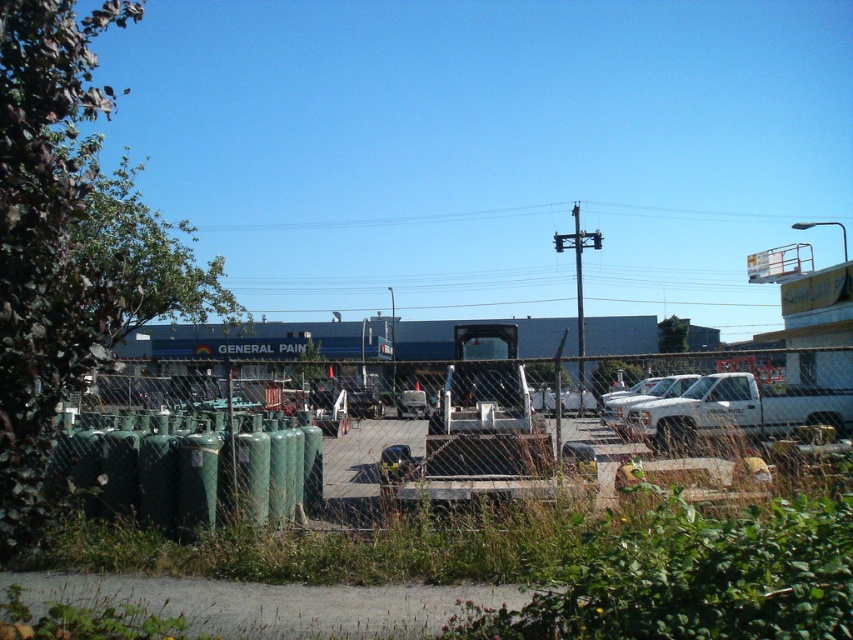
Question: Which point appears closest to the camera in this image?

Choices:
 (A) (218, 467)
 (B) (640, 432)

Answer: (A)

Question: Which point appears farthest from the camera in this image?

Choices:
 (A) tap(685, 385)
 (B) tap(734, 388)
 (C) tap(416, 484)

Answer: (A)

Question: Does green matte cylinders at lower left have a greater width compared to white matte truck at center?

Choices:
 (A) no
 (B) yes

Answer: (B)

Question: Which point is closer to the camera?

Choices:
 (A) (463, 458)
 (B) (619, 426)
 (C) (654, 416)

Answer: (A)

Question: Is green matte cylinders at lower left to the right of white matte truck at center from the viewer's perspective?

Choices:
 (A) yes
 (B) no

Answer: (B)

Question: Observing the image, what is the correct spatial positioning of white matte truck at right in reference to white matte truck at center?

Choices:
 (A) above
 (B) below

Answer: (B)